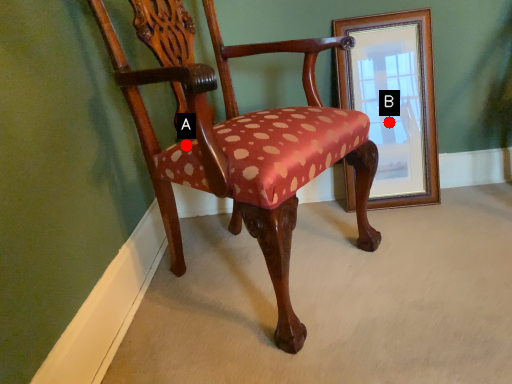
Question: Two points are circled on the image, labeled by A and B beside each circle. Which point is farther to the camera?

Choices:
 (A) A is further
 (B) B is further

Answer: (B)